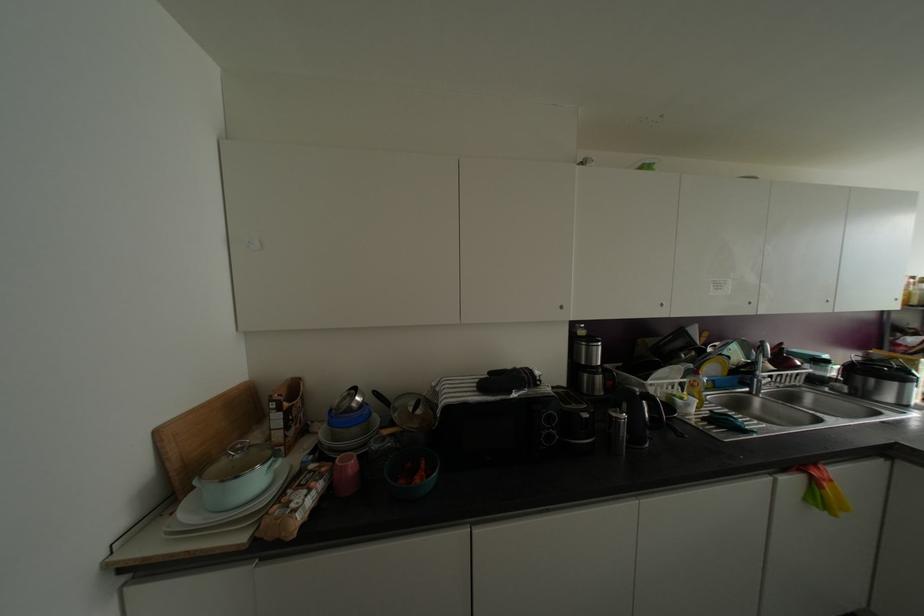
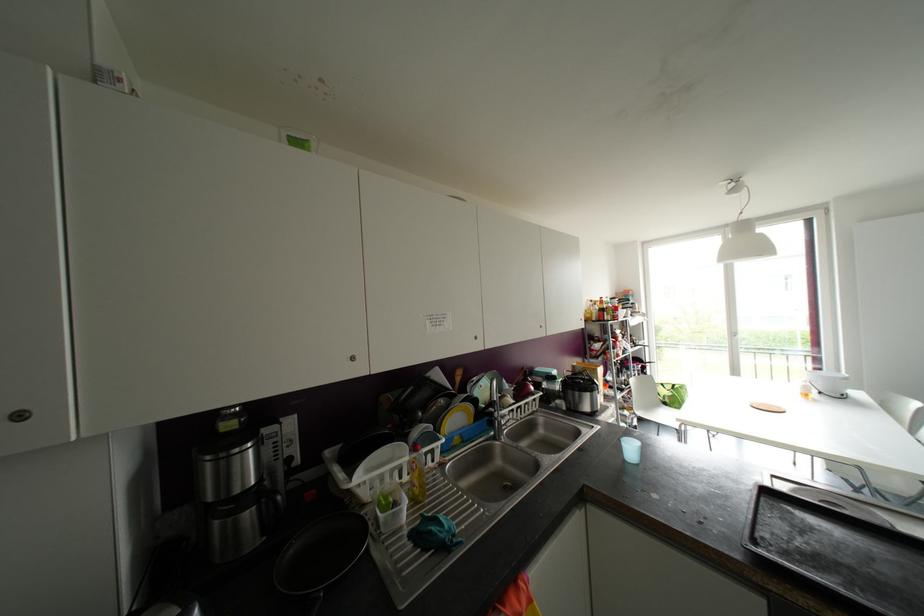
The point at [694,371] is marked in the first image. Where is the corresponding point in the second image?

(414, 448)